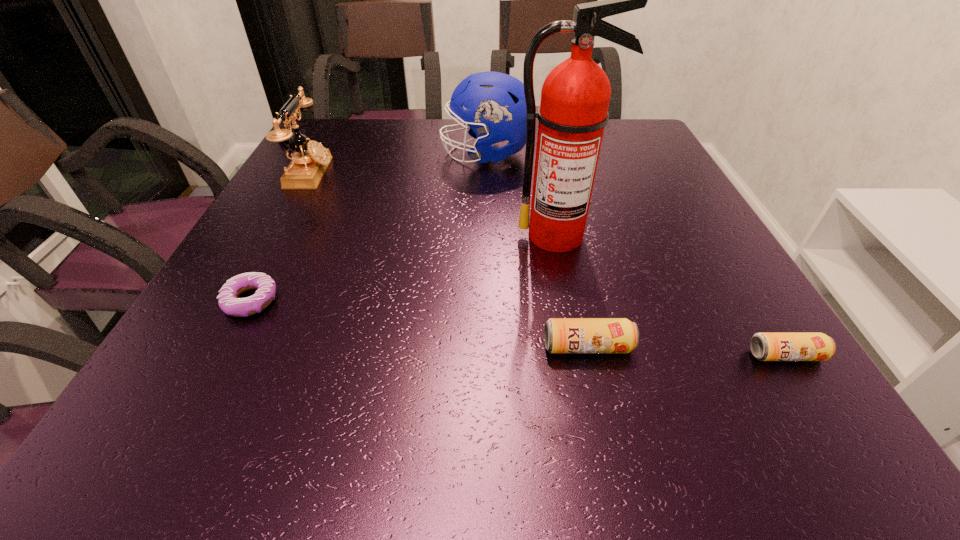
Locate which object is the second closest to the telephone. Please provide its 2D coordinates. Your answer should be formatted as a tuple, i.e. [(x, y)], where the tuple contains the x and y coordinates of a point satisfying the conditions above.

[(228, 301)]

Point out which object is positioned as the fifth nearest to the football helmet. Please provide its 2D coordinates. Your answer should be formatted as a tuple, i.e. [(x, y)], where the tuple contains the x and y coordinates of a point satisfying the conditions above.

[(764, 346)]

Identify the location of free space that satisfies the following two spatial constraints: 1. on the front-facing side of the rightmost object; 2. on the left side of the football helmet. The width and height of the screenshot is (960, 540). (491, 355).

I want to click on free space that satisfies the following two spatial constraints: 1. on the back side of the fifth tallest object; 2. on the front-facing side of the football helmet, so click(660, 154).

Where is `free space in the image that satisfies the following two spatial constraints: 1. on the back side of the rightmost object; 2. on the dial of the telephone`? This screenshot has height=540, width=960. free space in the image that satisfies the following two spatial constraints: 1. on the back side of the rightmost object; 2. on the dial of the telephone is located at coordinates (672, 173).

At what (x,y) coordinates should I click in order to perform the action: click on vacant position in the image that satisfies the following two spatial constraints: 1. on the dial of the doughnut; 2. on the left side of the third tallest object. Please return your answer as a coordinate pair (x, y). Looking at the image, I should click on (241, 301).

This screenshot has width=960, height=540. Identify the location of vacant position in the image that satisfies the following two spatial constraints: 1. on the front-facing side of the third shortest object; 2. on the right side of the football helmet. (491, 347).

You are a GUI agent. You are given a task and a screenshot of the screen. Output one action in this format:
    pyautogui.click(x=<x>, y=<y>)
    Task: Click on the vacant area in the image that satisfies the following two spatial constraints: 1. on the back side of the third nearest object; 2. on the dial of the third tallest object
    
    Given the screenshot: What is the action you would take?
    pyautogui.click(x=318, y=173)